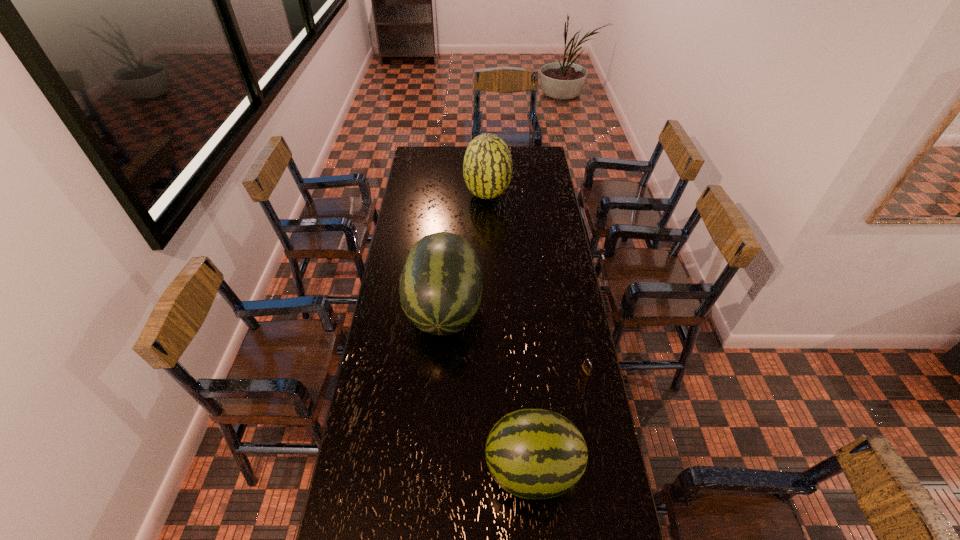
Where is `vacant space situated 0.050m at the stem end of the shortest watermelon`? Image resolution: width=960 pixels, height=540 pixels. vacant space situated 0.050m at the stem end of the shortest watermelon is located at coordinates (468, 469).

Locate an element on the screen. free region located 0.360m on the front of the padlock is located at coordinates (606, 491).

This screenshot has height=540, width=960. I want to click on object located at the left edge, so click(441, 281).

Locate an element on the screen. This screenshot has width=960, height=540. watermelon located at the right edge is located at coordinates (531, 453).

I want to click on padlock that is positioned at the right edge, so click(x=585, y=373).

Locate an element on the screen. The width and height of the screenshot is (960, 540). vacant region at the far edge of the desktop is located at coordinates (518, 152).

You are a GUI agent. You are given a task and a screenshot of the screen. Output one action in this format:
    pyautogui.click(x=<x>, y=<y>)
    Task: Click on the free space at the left edge
    
    Given the screenshot: What is the action you would take?
    pyautogui.click(x=391, y=394)

Where is `blank space at the right edge`? blank space at the right edge is located at coordinates (569, 289).

Where is `vacant area that lies between the farthest watermelon and the second nearest object`? vacant area that lies between the farthest watermelon and the second nearest object is located at coordinates (536, 286).

Identify the location of empty space between the shortest object and the farthest object. (536, 286).